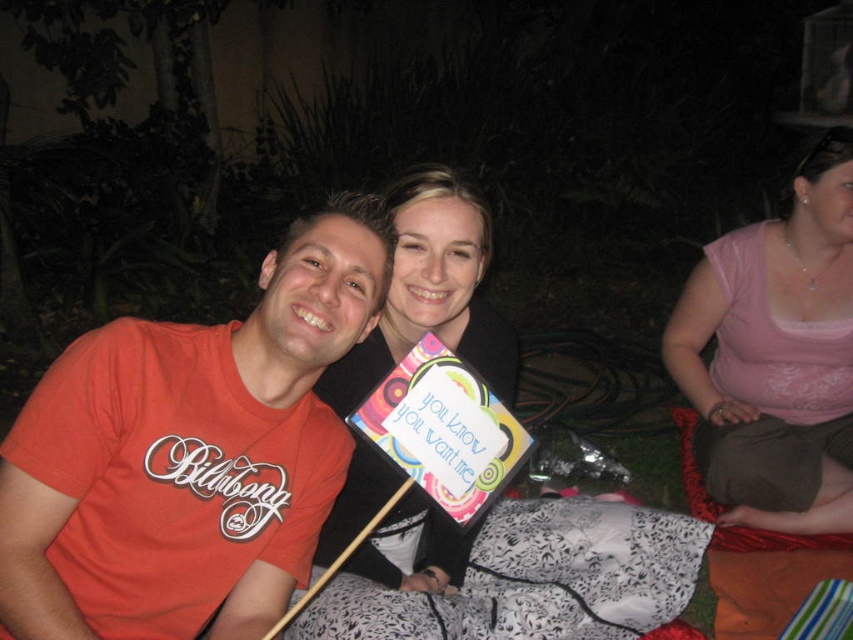
Between matte red t-shirt at left and pink fabric at right, which one has more height?

pink fabric at right is taller.

Can you confirm if matte red t-shirt at left is bigger than pink fabric at right?

Incorrect, matte red t-shirt at left is not larger than pink fabric at right.

Who is more forward, (x=215, y=400) or (x=811, y=262)?

Point (x=215, y=400) is in front.

Locate an element on the screen. matte red t-shirt at left is located at coordinates (190, 449).

Is point (701, 452) positioned before point (383, 554)?

That is False.

Does pink fabric at right appear on the right side of matte black sign at center?

Correct, you'll find pink fabric at right to the right of matte black sign at center.

Who is more distant from viewer, (x=746, y=436) or (x=415, y=512)?

Positioned behind is point (x=746, y=436).

Identify the location of pink fabric at right. This screenshot has width=853, height=640. (776, 355).

Between point (761, 392) and point (613, 557), which one is positioned behind?

Positioned behind is point (761, 392).

Who is shorter, pink fabric at right or black printed fabric blanket at center?

With less height is black printed fabric blanket at center.

What do you see at coordinates (776, 355) in the screenshot? The image size is (853, 640). I see `pink fabric at right` at bounding box center [776, 355].

This screenshot has width=853, height=640. I want to click on pink fabric at right, so click(x=776, y=355).